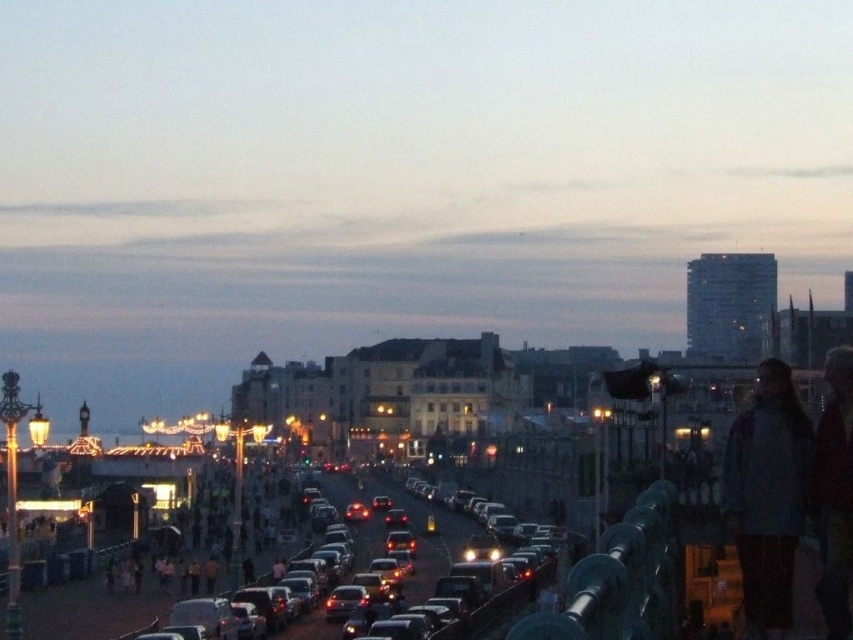
Question: Among these points, which one is farthest from the camera?

Choices:
 (A) (799, 435)
 (B) (305, 625)

Answer: (B)

Question: From the image, what is the correct spatial relationship of light gray sweater at right in relation to shiny silver car at center?

Choices:
 (A) below
 (B) above

Answer: (B)

Question: Can you confirm if light gray sweater at right is positioned below shiny silver car at center?

Choices:
 (A) no
 (B) yes

Answer: (A)

Question: Which object appears closest to the camera in this image?

Choices:
 (A) shiny silver car at center
 (B) light gray sweater at right

Answer: (B)

Question: Is light gray sweater at right positioned at the back of shiny silver car at center?

Choices:
 (A) yes
 (B) no

Answer: (B)